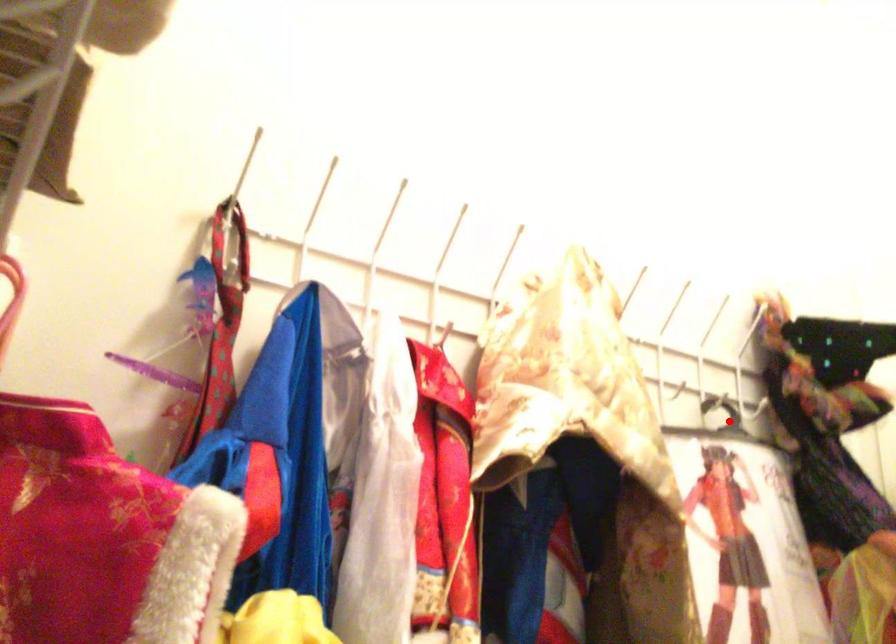
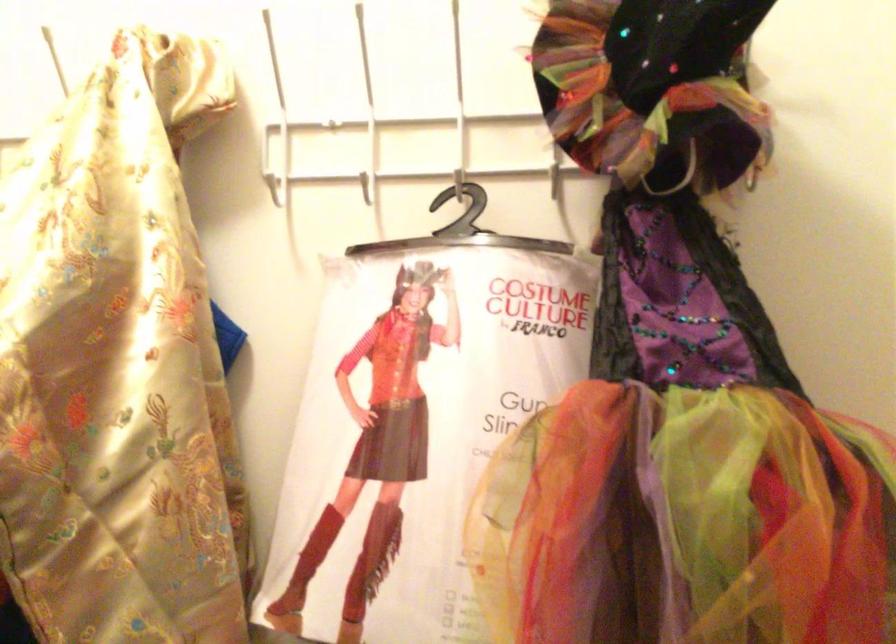
Question: I am providing you with two images of the same scene from different viewpoints. Image1 has a red point marked. In image2, the corresponding 3D location appears at what relative position? Reply with the corresponding letter.

Choices:
 (A) Closer
 (B) Farther

Answer: (A)